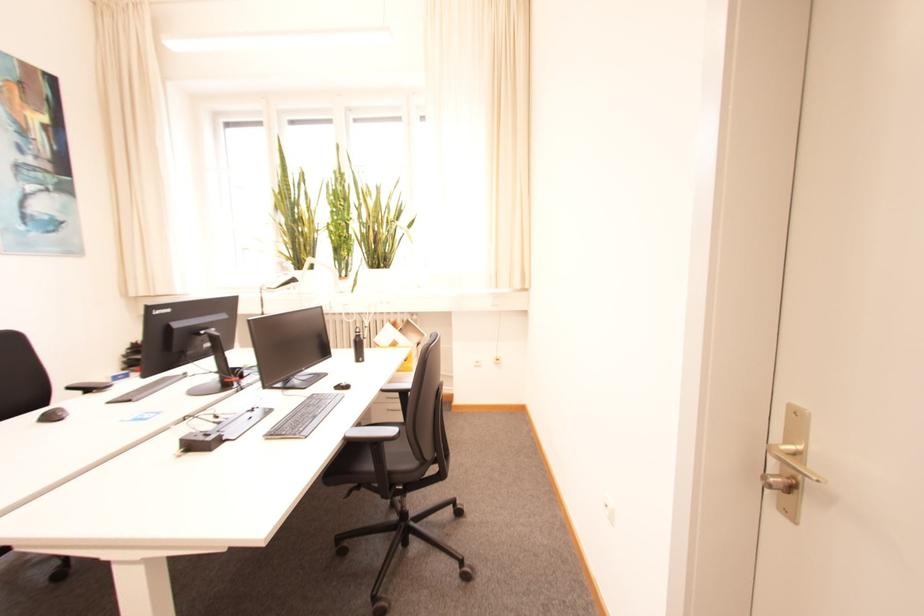
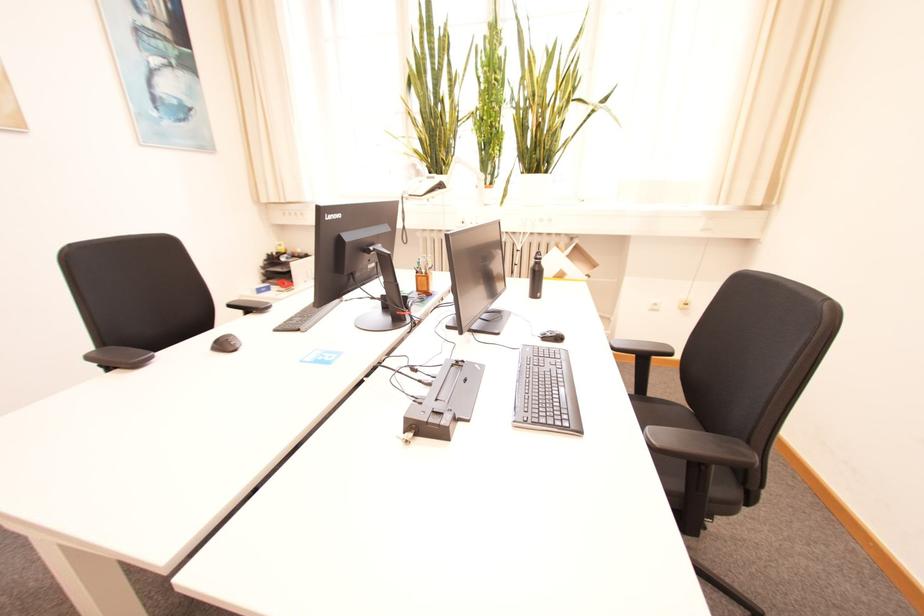
Find the pixel in the second image that matches [293,275] in the first image.

(440, 177)